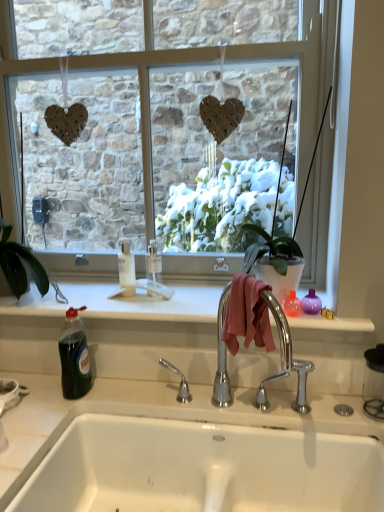
Question: Is clear glass window at center inside the boundaries of green glossy houseplant at left, or outside?

Choices:
 (A) inside
 (B) outside

Answer: (B)

Question: In the image, is clear glass window at center positioned in front of or behind green glossy houseplant at left?

Choices:
 (A) front
 (B) behind

Answer: (A)

Question: Considering the real-world distances, which object is farthest from the green translucent bottle at lower left?

Choices:
 (A) green glossy houseplant at left
 (B) clear glass window at center
 (C) white glossy sink at lower center

Answer: (B)

Question: Estimate the real-world distances between objects in this image. Which object is closer to the clear glass window at center?

Choices:
 (A) green translucent bottle at lower left
 (B) white glossy sink at lower center
 (C) green glossy houseplant at left

Answer: (C)